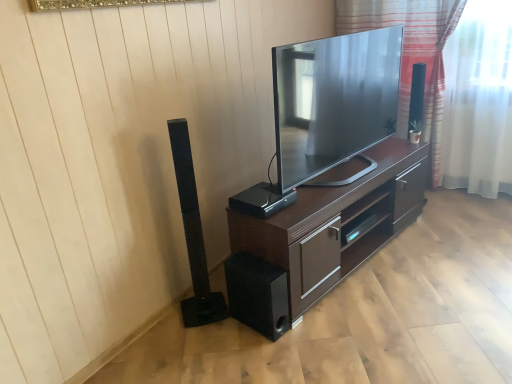
Find the location of a particular element. Image resolution: width=512 pixels, height=384 pixels. empty space that is to the right of black matte speaker at lower center, the second speaker when ordered from left to right is located at coordinates (310, 328).